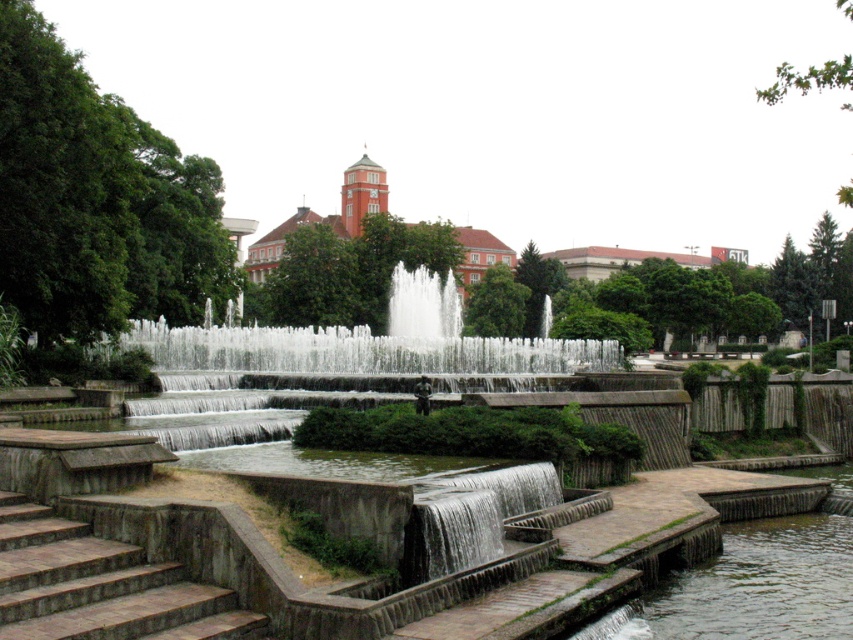
Question: Which object is closer to the camera taking this photo?

Choices:
 (A) smooth concrete waterfall at lower center
 (B) white frothy water at center
 (C) brown stone stairs at lower left

Answer: (C)

Question: Does white concrete fountain at center have a lesser width compared to clear concrete waterfall at center?

Choices:
 (A) yes
 (B) no

Answer: (A)

Question: Can you confirm if clear water at bottom right is positioned above white frothy water at center?

Choices:
 (A) no
 (B) yes

Answer: (A)

Question: Where is white concrete fountain at center located in relation to white frothy water at center in the image?

Choices:
 (A) below
 (B) above

Answer: (A)

Question: Which object is the farthest from the brown stone stairs at lower left?

Choices:
 (A) white concrete fountain at center
 (B) clear water at bottom right
 (C) white frothy water at center

Answer: (C)

Question: Which of these objects is positioned closest to the clear water at bottom right?

Choices:
 (A) smooth concrete waterfall at lower center
 (B) white concrete fountain at center
 (C) brown stone stairs at lower left
 (D) clear concrete waterfall at center

Answer: (A)